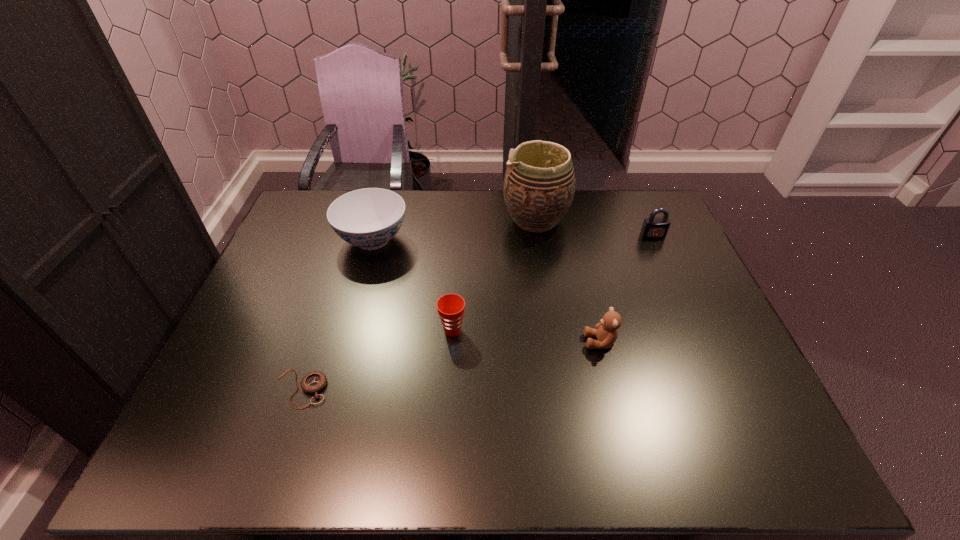
Locate an element on the screen. The image size is (960, 540). vacant space located on the face of the teddy bear is located at coordinates (507, 342).

Image resolution: width=960 pixels, height=540 pixels. I want to click on free spot located 0.110m on the face of the teddy bear, so click(541, 342).

What are the coordinates of `vacant space located 0.070m on the face of the teddy bear` in the screenshot? It's located at (558, 342).

Image resolution: width=960 pixels, height=540 pixels. What are the coordinates of `vacant position located 0.330m on the right of the cup` in the screenshot? It's located at (592, 330).

You are a GUI agent. You are given a task and a screenshot of the screen. Output one action in this format:
    pyautogui.click(x=<x>, y=<y>)
    Task: Click on the free spot located 0.110m on the front of the nearest object
    
    Given the screenshot: What is the action you would take?
    pyautogui.click(x=277, y=458)

This screenshot has height=540, width=960. I want to click on pottery positioned at the far edge, so click(539, 185).

In order to click on chinaware present at the far edge in this screenshot , I will do `click(368, 218)`.

The image size is (960, 540). I want to click on object that is at the left edge, so click(x=312, y=383).

Where is `object situated at the right edge`? The height and width of the screenshot is (540, 960). object situated at the right edge is located at coordinates point(653,227).

The width and height of the screenshot is (960, 540). Identify the location of vacant area at the far edge. (456, 215).